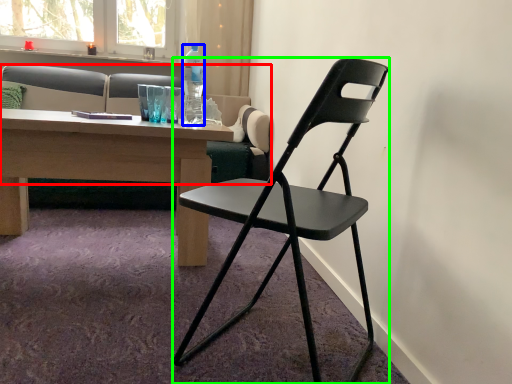
Question: Which object is the closest to the studio couch (highlighted by a red box)? Choose among these: bottle (highlighted by a blue box) or chair (highlighted by a green box).

Choices:
 (A) bottle
 (B) chair

Answer: (A)